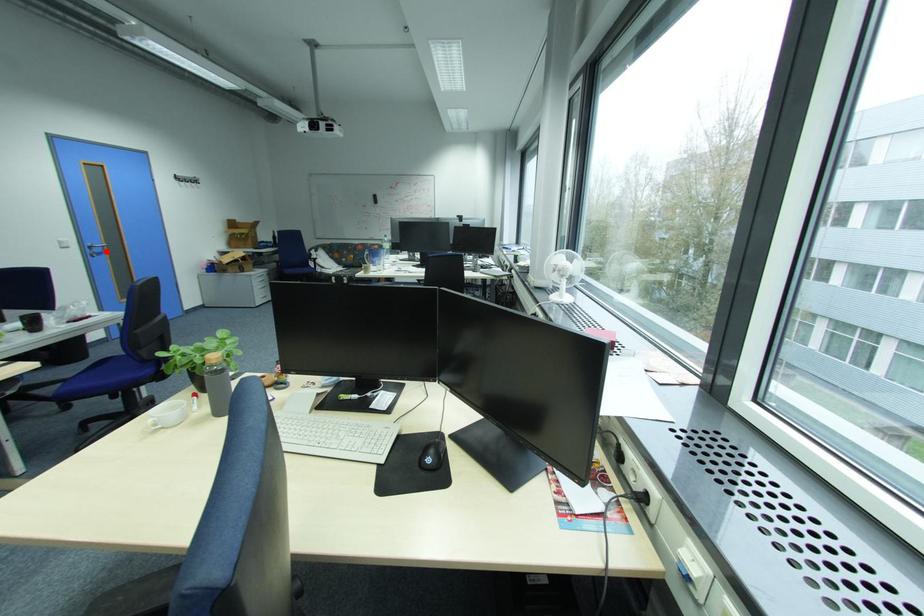
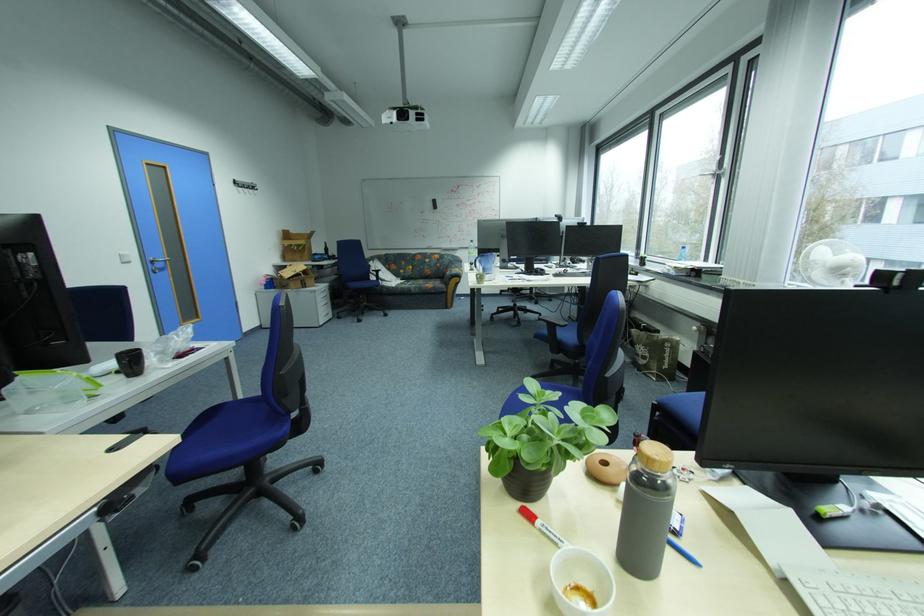
Question: I am providing you with two images of the same scene from different viewpoints. A red point is shown in image1. For the corresponding object point in image2, is it positioned nearer or farther from the camera?

Choices:
 (A) Nearer
 (B) Farther

Answer: (A)